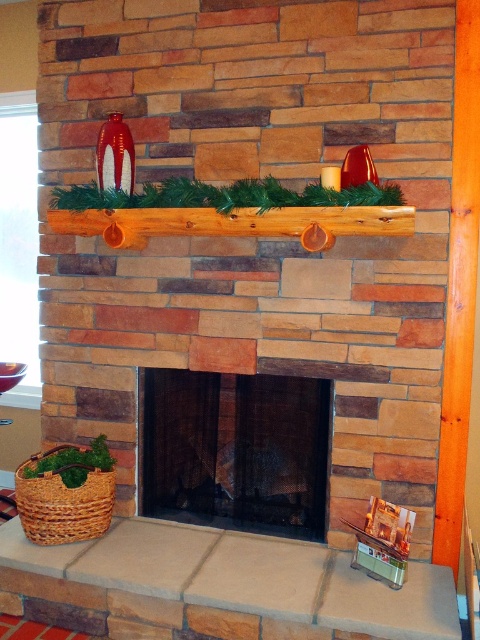
Between point (283, 416) and point (345, 225), which one is positioned behind?

Positioned behind is point (283, 416).

Is point (319, 378) closer to viewer compared to point (132, 221)?

No, it is not.

Who is more forward, (284,436) or (137,209)?

Point (137,209)

The width and height of the screenshot is (480, 640). What are the coordinates of `black mesh fireplace at center` in the screenshot? It's located at (236, 451).

Measure the distance between smooth wood mantel at center and camera.

A distance of 1.77 meters exists between smooth wood mantel at center and camera.

The image size is (480, 640). I want to click on smooth wood mantel at center, so pos(218,586).

Is smooth wood mantel at center to the right of black mesh fireplace at center from the viewer's perspective?

In fact, smooth wood mantel at center is to the left of black mesh fireplace at center.

Is point (197, 568) more distant than point (222, 380)?

No, (197, 568) is in front of (222, 380).

The height and width of the screenshot is (640, 480). I want to click on smooth wood mantel at center, so click(218, 586).